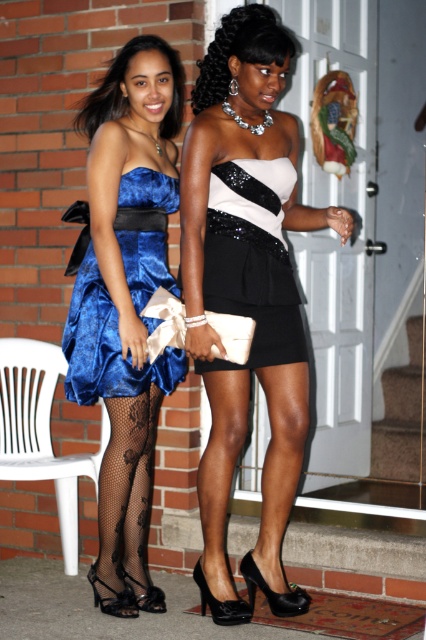
You are a photographer setting up a shoot at the location shown. You need to ensure that the black sequined dress at center is visible without being blocked by the black patent leather high heels at lower center. Based on their positions, can you confirm if the dress will be visible?

The black sequined dress at center is positioned over the black patent leather high heels at lower center, so the dress will be visible as it is placed above the heels and not blocking them.

You are a photographer setting up for a photoshoot. You need to position a small stool between the velvet blue dress at left and the black patent leather high heels at lower center. Based on their positions, where should you place the stool?

The velvet blue dress at left is located above the black patent leather high heels at lower center, so you should place the stool below the velvet blue dress at left and above the black patent leather high heels at lower center to position it between them.